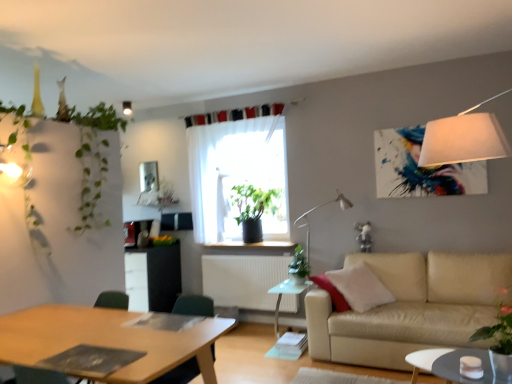
Locate an element on the screen. This screenshot has height=384, width=512. beige leather couch at lower right is located at coordinates (410, 308).

What do you see at coordinates (288, 293) in the screenshot? I see `translucent plastic table at center` at bounding box center [288, 293].

Locate an element on the screen. This screenshot has width=512, height=384. green leafy plant at lower right, placed as the 5th plant when sorted from back to front is located at coordinates (498, 327).

What do you see at coordinates (111, 338) in the screenshot?
I see `wooden desk at lower left` at bounding box center [111, 338].

Describe the element at coordinates (194, 305) in the screenshot. The width and height of the screenshot is (512, 384). I see `green plastic swivel chair at lower left` at that location.

Describe the element at coordinates (253, 201) in the screenshot. I see `green matte plant at center, which appears as the 2th plant when viewed from the back` at that location.

Where is `green matte plant at center, which appears as the 2th plant when viewed from the back`? The width and height of the screenshot is (512, 384). green matte plant at center, which appears as the 2th plant when viewed from the back is located at coordinates (253, 201).

What are the coordinates of `white glossy coffee table at lower right` in the screenshot? It's located at (449, 364).

Considering the sizes of objects translucent plastic table at center and sheer white curtain at center in the image provided, who is smaller, translucent plastic table at center or sheer white curtain at center?

With smaller size is translucent plastic table at center.

Choose the correct answer: Is translucent plastic table at center inside sheer white curtain at center or outside it?

translucent plastic table at center is not enclosed by sheer white curtain at center.

In terms of width, does translucent plastic table at center look wider or thinner when compared to sheer white curtain at center?

In the image, translucent plastic table at center appears to be wider than sheer white curtain at center.

Which of these two, green leafy plant at center, marked as the 2th plant in a left-to-right arrangement, or sheer white curtain at center, is bigger?

sheer white curtain at center is bigger.

The height and width of the screenshot is (384, 512). What are the coordinates of `the 1st plant to the left of the sheer white curtain at center, starting your count from the anchor` in the screenshot? It's located at (165, 195).

Could you tell me if green leafy plant at center, placed as the 1th plant when sorted from back to front, is turned towards sheer white curtain at center?

No, green leafy plant at center, placed as the 1th plant when sorted from back to front, is not oriented towards sheer white curtain at center.

Could you measure the distance between green leafy plant at center, the 5th plant viewed from the front, and sheer white curtain at center?

A distance of 1.22 meters exists between green leafy plant at center, the 5th plant viewed from the front, and sheer white curtain at center.

In the scene shown: Is green leafy plant at center, which is the fourth plant in right-to-left order, positioned beyond the bounds of green leafy plant at upper left, which is counted as the 5th plant, starting from the right?

Yes, green leafy plant at center, which is the fourth plant in right-to-left order, is outside of green leafy plant at upper left, which is counted as the 5th plant, starting from the right.

In the scene shown: From a real-world perspective, who is located higher, green leafy plant at center, marked as the 2th plant in a left-to-right arrangement, or green leafy plant at upper left, the 2th plant viewed from the front?

In real-world perspective, green leafy plant at upper left, the 2th plant viewed from the front, is above.

Is green leafy plant at center, which is the fourth plant in right-to-left order, not near green leafy plant at upper left, which is the first plant from left to right?

Indeed, green leafy plant at center, which is the fourth plant in right-to-left order, is not near green leafy plant at upper left, which is the first plant from left to right.

Is the surface of sheer white curtain at center in direct contact with white matte light fixture at upper center?

No, sheer white curtain at center is not beside white matte light fixture at upper center.

Considering the relative sizes of sheer white curtain at center and white matte light fixture at upper center in the image provided, is sheer white curtain at center wider than white matte light fixture at upper center?

Yes, sheer white curtain at center is wider than white matte light fixture at upper center.

From the image's perspective, which is below, sheer white curtain at center or white matte light fixture at upper center?

From the image's view, sheer white curtain at center is below.

Looking at this image, what's the angular difference between sheer white curtain at center and white matte light fixture at upper center's facing directions?

The angle between the facing direction of sheer white curtain at center and the facing direction of white matte light fixture at upper center is 1.52 degrees.

Which object is further away from the camera taking this photo, green leafy plant at center, the 5th plant viewed from the front, or wooden desk at lower left?

Positioned behind is green leafy plant at center, the 5th plant viewed from the front.

Considering the sizes of objects green leafy plant at center, marked as the 2th plant in a left-to-right arrangement, and wooden desk at lower left in the image provided, who is wider, green leafy plant at center, marked as the 2th plant in a left-to-right arrangement, or wooden desk at lower left?

wooden desk at lower left.

How different are the orientations of green leafy plant at center, marked as the 2th plant in a left-to-right arrangement, and wooden desk at lower left in degrees?

There is a 180-degree angle between the facing directions of green leafy plant at center, marked as the 2th plant in a left-to-right arrangement, and wooden desk at lower left.

Between green leafy plant at center, marked as the 2th plant in a left-to-right arrangement, and wooden desk at lower left, which one has smaller size?

With smaller size is green leafy plant at center, marked as the 2th plant in a left-to-right arrangement.

From the image's perspective, would you say wooden desk at lower left is positioned over white matte radiator at center?

Actually, wooden desk at lower left appears below white matte radiator at center in the image.

From a real-world perspective, is wooden desk at lower left positioned under white matte radiator at center based on gravity?

No, from a real-world perspective, wooden desk at lower left is not under white matte radiator at center.

What's the angular difference between wooden desk at lower left and white matte radiator at center's facing directions?

wooden desk at lower left and white matte radiator at center are facing 180 degrees away from each other.

Does point (14, 355) come in front of point (236, 258)?

Yes.

Is translucent plastic table at center inside or outside of green leafy plant at upper left, which is the first plant from left to right?

The correct answer is: outside.

How many degrees apart are the facing directions of translucent plastic table at center and green leafy plant at upper left, the 2th plant viewed from the front?

There is a 89.5-degree angle between the facing directions of translucent plastic table at center and green leafy plant at upper left, the 2th plant viewed from the front.

Considering the points (294, 287) and (108, 113), which point is behind, point (294, 287) or point (108, 113)?

Point (294, 287)

The image size is (512, 384). Identify the location of curtain behind the translucent plastic table at center. 238,177.

Find the location of a particular element. the 1st plant counting from the left of the sheer white curtain at center is located at coordinates (165, 195).

Considering their positions, is green matte plant at center, which appears as the third plant when viewed from the left, positioned further to white matte radiator at center than translucent plastic table at center?

green matte plant at center, which appears as the third plant when viewed from the left, is further to white matte radiator at center.

Estimate the real-world distances between objects in this image. Which object is closer to wooden desk at lower left, white matte light fixture at upper center or green matte plant at center, acting as the third plant starting from the front?

green matte plant at center, acting as the third plant starting from the front.

From the image, which object appears to be farther from wooden desk at lower left, green matte plant at center, the 2th plant viewed from the right, or green matte plant at center, arranged as the 4th plant when viewed from the front?

green matte plant at center, arranged as the 4th plant when viewed from the front, is positioned further to the anchor wooden desk at lower left.

Looking at the image, which one is located further to white matte light fixture at upper center, green matte plant at center, the 2th plant viewed from the right, or green matte plant at center, which is the 3th plant from right to left?

green matte plant at center, the 2th plant viewed from the right.

Considering their positions, is translucent plastic table at center positioned closer to white matte light fixture at upper center than white glossy coffee table at lower right?

translucent plastic table at center.

When comparing their distances from white matte light fixture at upper center, does green matte plant at center, which is the 3th plant from right to left, or green matte plant at center, acting as the third plant starting from the front, seem further?

green matte plant at center, acting as the third plant starting from the front, is further to white matte light fixture at upper center.

Which object lies further to the anchor point green leafy plant at center, marked as the 2th plant in a left-to-right arrangement, green matte plant at center, which is the 3th plant from right to left, or white glossy coffee table at lower right?

white glossy coffee table at lower right is positioned further to the anchor green leafy plant at center, marked as the 2th plant in a left-to-right arrangement.

From the image, which object appears to be farther from wooden desk at lower left, green leafy plant at lower right, the first plant from the right, or beige leather couch at lower right?

green leafy plant at lower right, the first plant from the right, is positioned further to the anchor wooden desk at lower left.

Identify the location of table between wooden desk at lower left and green leafy plant at center, marked as the 2th plant in a left-to-right arrangement, from front to back. The width and height of the screenshot is (512, 384). (288, 293).

This screenshot has width=512, height=384. I want to click on studio couch between white glossy coffee table at lower right and white matte radiator at center in the front-back direction, so click(410, 308).

This screenshot has height=384, width=512. Find the location of `table between wooden desk at lower left and green matte plant at center, the fourth plant positioned from the left, from front to back`. table between wooden desk at lower left and green matte plant at center, the fourth plant positioned from the left, from front to back is located at coordinates (288, 293).

At what (x,y) coordinates should I click in order to perform the action: click on radiator located between white glossy coffee table at lower right and green matte plant at center, which appears as the third plant when viewed from the left, in the depth direction. Please return your answer as a coordinate pair (x, y). Looking at the image, I should click on (243, 279).